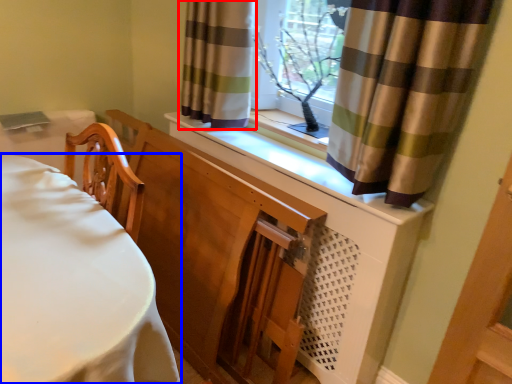
Question: Which of the following is the closest to the observer, curtain (highlighted by a red box) or furniture (highlighted by a blue box)?

Choices:
 (A) curtain
 (B) furniture

Answer: (B)